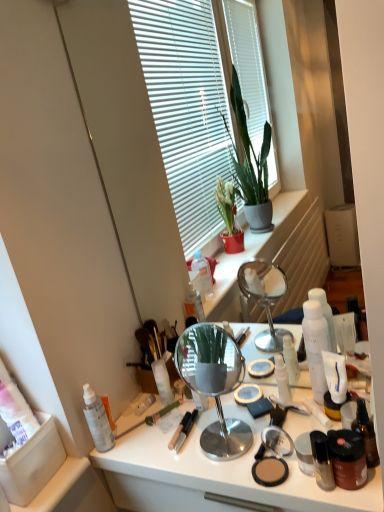
What do you see at coordinates (347, 458) in the screenshot? The height and width of the screenshot is (512, 384). I see `matte brown jar at lower right, marked as the second toiletry in a right-to-left arrangement` at bounding box center [347, 458].

Describe the element at coordinates (214, 384) in the screenshot. The image size is (384, 512). I see `polished silver mirror at center` at that location.

The image size is (384, 512). What do you see at coordinates (366, 433) in the screenshot? I see `shiny brown bottle at right, which is the first toiletry from right to left` at bounding box center [366, 433].

Locate an element on the screen. The width and height of the screenshot is (384, 512). matte brown compact at lower center is located at coordinates (270, 471).

The image size is (384, 512). What do you see at coordinates (163, 381) in the screenshot?
I see `white plastic container at center, the 6th toiletry when ordered from right to left` at bounding box center [163, 381].

Where is `white plastic container at center, the 6th toiletry when ordered from right to left`? white plastic container at center, the 6th toiletry when ordered from right to left is located at coordinates (163, 381).

Locate an element on the screen. matte brown jar at lower right, marked as the second toiletry in a right-to-left arrangement is located at coordinates (347, 458).

From the image's perspective, who appears lower, metallic silver mirror at center or shiny brown bottle at right, the 7th toiletry positioned from the left?

metallic silver mirror at center, from the image's perspective.

Is metallic silver mirror at center not near shiny brown bottle at right, the 7th toiletry positioned from the left?

They are positioned close to each other.

This screenshot has height=512, width=384. I want to click on counter that appears in front of the shiny brown bottle at right, the 7th toiletry positioned from the left, so click(x=214, y=473).

Considering their positions, is white plastic container at center, positioned as the 2th toiletry in left-to-right order, located in front of or behind shiny black bottle at lower right, the 4th toiletry viewed from the right?

white plastic container at center, positioned as the 2th toiletry in left-to-right order, is behind shiny black bottle at lower right, the 4th toiletry viewed from the right.

Visually, is white plastic container at center, positioned as the 2th toiletry in left-to-right order, positioned to the left or to the right of shiny black bottle at lower right, the 4th toiletry viewed from the right?

Based on their positions, white plastic container at center, positioned as the 2th toiletry in left-to-right order, is located to the left of shiny black bottle at lower right, the 4th toiletry viewed from the right.

This screenshot has width=384, height=512. What are the coordinates of `the 2nd toiletry counting from the right of the white plastic container at center, the 6th toiletry when ordered from right to left` in the screenshot? It's located at (322, 461).

From a real-world perspective, between white plastic container at center, positioned as the 2th toiletry in left-to-right order, and shiny black bottle at lower right, which is counted as the fourth toiletry, starting from the left, who is vertically lower?

shiny black bottle at lower right, which is counted as the fourth toiletry, starting from the left.

In the image, is shiny brown bottle at right, which is the first toiletry from right to left, positioned in front of or behind white glossy lotion at center, placed as the fifth toiletry when sorted from right to left?

Clearly, shiny brown bottle at right, which is the first toiletry from right to left, is in front of white glossy lotion at center, placed as the fifth toiletry when sorted from right to left.

From the image's perspective, is shiny brown bottle at right, which is the first toiletry from right to left, located beneath white glossy lotion at center, placed as the fifth toiletry when sorted from right to left?

Yes, from the image's perspective, shiny brown bottle at right, which is the first toiletry from right to left, is beneath white glossy lotion at center, placed as the fifth toiletry when sorted from right to left.

From a real-world perspective, who is located lower, shiny brown bottle at right, which is the first toiletry from right to left, or white glossy lotion at center, placed as the fifth toiletry when sorted from right to left?

white glossy lotion at center, placed as the fifth toiletry when sorted from right to left, from a real-world perspective.

Which point is more distant from viewer, [361,410] or [289,390]?

Point [289,390]

From a real-world perspective, is transparent plastic spray bottle at left, the 7th toiletry in the right-to-left sequence, physically located above or below shiny black bottle at lower right, the 4th toiletry viewed from the right?

Clearly, from a real-world perspective, transparent plastic spray bottle at left, the 7th toiletry in the right-to-left sequence, is above shiny black bottle at lower right, the 4th toiletry viewed from the right.

Which object is more forward, transparent plastic spray bottle at left, the 7th toiletry in the right-to-left sequence, or shiny black bottle at lower right, which is counted as the fourth toiletry, starting from the left?

shiny black bottle at lower right, which is counted as the fourth toiletry, starting from the left, is more forward.

From the image's perspective, would you say transparent plastic spray bottle at left, the 7th toiletry in the right-to-left sequence, is positioned over shiny black bottle at lower right, the 4th toiletry viewed from the right?

Yes.

What are the coordinates of `the 3rd toiletry counting from the right of the transparent plastic spray bottle at left, the 7th toiletry in the right-to-left sequence` in the screenshot? It's located at (322, 461).

Which is behind, point (164, 379) or point (280, 373)?

The point (164, 379) is more distant.

Would you say white plastic container at center, the 6th toiletry when ordered from right to left, is inside or outside white glossy lotion at center, placed as the fifth toiletry when sorted from right to left?

The correct answer is: outside.

From the image's perspective, is white plastic container at center, the 6th toiletry when ordered from right to left, above or below white glossy lotion at center, placed as the third toiletry when sorted from left to right?

Based on their image positions, white plastic container at center, the 6th toiletry when ordered from right to left, is located beneath white glossy lotion at center, placed as the third toiletry when sorted from left to right.

Is white plastic container at center, the 6th toiletry when ordered from right to left, to the left of white glossy lotion at center, placed as the fifth toiletry when sorted from right to left, from the viewer's perspective?

Yes, white plastic container at center, the 6th toiletry when ordered from right to left, is to the left of white glossy lotion at center, placed as the fifth toiletry when sorted from right to left.

Is white matte lotion at right, the fifth toiletry positioned from the left, closer to camera compared to white plastic container at center, the 6th toiletry when ordered from right to left?

Yes.

From their relative heights in the image, would you say white matte lotion at right, the fifth toiletry positioned from the left, is taller or shorter than white plastic container at center, positioned as the 2th toiletry in left-to-right order?

In the image, white matte lotion at right, the fifth toiletry positioned from the left, appears to be taller than white plastic container at center, positioned as the 2th toiletry in left-to-right order.

I want to click on toiletry that is the 4th one below the white matte lotion at right, the fifth toiletry positioned from the left (from a real-world perspective), so click(163, 381).

Between white matte lotion at right, the fifth toiletry positioned from the left, and white plastic container at center, the 6th toiletry when ordered from right to left, which one has larger size?

white matte lotion at right, the fifth toiletry positioned from the left, is bigger.

From the picture: Between shiny black bottle at lower right, the 4th toiletry viewed from the right, and metallic silver mirror at center, which one has smaller size?

shiny black bottle at lower right, the 4th toiletry viewed from the right.

From the image's perspective, which one is positioned higher, shiny black bottle at lower right, the 4th toiletry viewed from the right, or metallic silver mirror at center?

shiny black bottle at lower right, the 4th toiletry viewed from the right, is shown above in the image.

Where is `counter that appears below the shiny black bottle at lower right, which is counted as the fourth toiletry, starting from the left (from a real-world perspective)`? The image size is (384, 512). counter that appears below the shiny black bottle at lower right, which is counted as the fourth toiletry, starting from the left (from a real-world perspective) is located at coordinates (214, 473).

Could metallic silver mirror at center be considered to be inside shiny black bottle at lower right, which is counted as the fourth toiletry, starting from the left?

That's incorrect, metallic silver mirror at center is not inside shiny black bottle at lower right, which is counted as the fourth toiletry, starting from the left.

Starting from the metallic silver mirror at center, which toiletry is the 5th one to the right? Please provide its 2D coordinates.

[(366, 433)]

There is a white plastic container at center, positioned as the 2th toiletry in left-to-right order. Identify the location of the 1st toiletry below it (from a real-world perspective). The width and height of the screenshot is (384, 512). (322, 461).

Looking at the image, which one is located further to white plastic container at center, positioned as the 2th toiletry in left-to-right order, green plastic paint brush at lower left or shiny brown bottle at right, the 7th toiletry positioned from the left?

The object further to white plastic container at center, positioned as the 2th toiletry in left-to-right order, is shiny brown bottle at right, the 7th toiletry positioned from the left.

Considering their positions, is white plastic container at center, the 6th toiletry when ordered from right to left, positioned closer to metallic silver mirror at center than white glossy lotion at center, placed as the fifth toiletry when sorted from right to left?

white plastic container at center, the 6th toiletry when ordered from right to left.

When comparing their distances from transparent plastic spray bottle at left, the 7th toiletry in the right-to-left sequence, does metallic silver mirror at center or white matte lotion at right, acting as the third toiletry starting from the right, seem closer?

metallic silver mirror at center lies closer to transparent plastic spray bottle at left, the 7th toiletry in the right-to-left sequence, than the other object.

Looking at this image, which object lies nearer to the anchor point transparent plastic spray bottle at left, the 1th toiletry in the left-to-right sequence, shiny black bottle at lower right, the 4th toiletry viewed from the right, or matte brown compact at lower center?

matte brown compact at lower center lies closer to transparent plastic spray bottle at left, the 1th toiletry in the left-to-right sequence, than the other object.

Based on their spatial positions, is white plastic container at center, positioned as the 2th toiletry in left-to-right order, or white matte lotion at right, the fifth toiletry positioned from the left, further from metallic silver mirror at center?

white matte lotion at right, the fifth toiletry positioned from the left.

From the image, which object appears to be farther from transparent plastic spray bottle at left, the 1th toiletry in the left-to-right sequence, shiny black bottle at lower right, which is counted as the fourth toiletry, starting from the left, or matte brown jar at lower right, which appears as the 6th toiletry when viewed from the left?

Among the two, matte brown jar at lower right, which appears as the 6th toiletry when viewed from the left, is located further to transparent plastic spray bottle at left, the 1th toiletry in the left-to-right sequence.

When comparing their distances from shiny brown bottle at right, which is the first toiletry from right to left, does white glossy lotion at center, placed as the third toiletry when sorted from left to right, or matte brown compact at lower center seem further?

Based on the image, white glossy lotion at center, placed as the third toiletry when sorted from left to right, appears to be further to shiny brown bottle at right, which is the first toiletry from right to left.

Considering their positions, is matte brown jar at lower right, which appears as the 6th toiletry when viewed from the left, positioned closer to polished silver mirror at center than matte brown compact at lower center?

The object closer to polished silver mirror at center is matte brown compact at lower center.

Locate an element on the screen. Image resolution: width=384 pixels, height=512 pixels. counter situated between transparent plastic spray bottle at left, the 1th toiletry in the left-to-right sequence, and matte brown compact at lower center from left to right is located at coordinates (214, 473).

Find the location of a particular element. toiletry between green plastic paint brush at lower left and white glossy lotion at center, placed as the fifth toiletry when sorted from right to left, from left to right is located at coordinates (163, 381).

The width and height of the screenshot is (384, 512). I want to click on face powder between transparent plastic spray bottle at left, the 1th toiletry in the left-to-right sequence, and shiny brown bottle at right, the 7th toiletry positioned from the left, in the horizontal direction, so (x=270, y=471).

In order to click on paint brush between transparent plastic spray bottle at left, the 1th toiletry in the left-to-right sequence, and matte brown compact at lower center in this screenshot , I will do `click(154, 417)`.